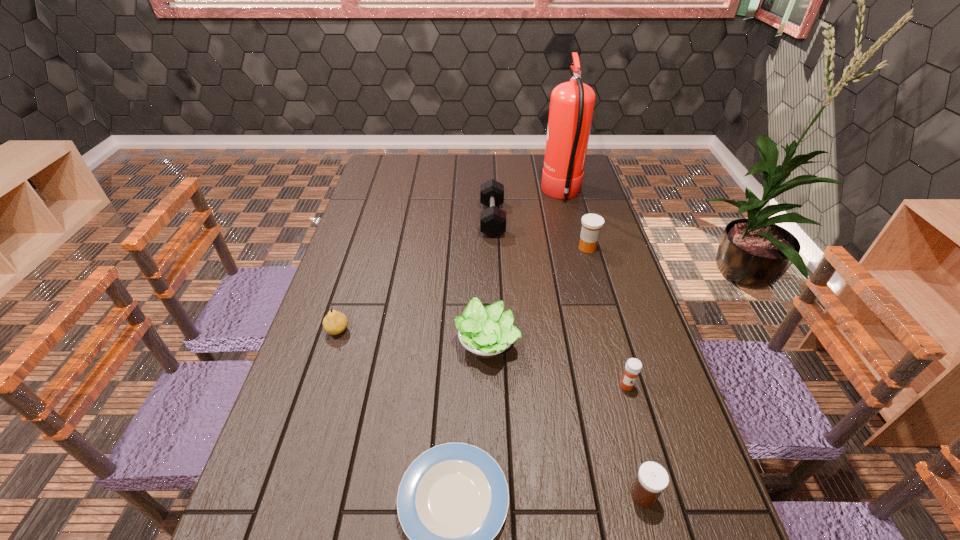
The height and width of the screenshot is (540, 960). I want to click on free space located towards the nozzle of the fire extinguisher, so click(x=529, y=195).

Locate an element on the screen. This screenshot has width=960, height=540. free spot located on the label of the third farthest object is located at coordinates (463, 248).

The height and width of the screenshot is (540, 960). I want to click on vacant region located on the label of the third farthest object, so click(x=535, y=248).

This screenshot has height=540, width=960. What are the coordinates of `vacant space situated 0.300m on the label of the third farthest object` in the screenshot? It's located at point(487,248).

Find the location of a particular element. The image size is (960, 540). vacant space located on the front of the dumbbell is located at coordinates (495, 306).

Locate an element on the screen. Image resolution: width=960 pixels, height=540 pixels. free location located 0.190m on the right of the leftmost object is located at coordinates (420, 330).

Find the location of a particular element. Image resolution: width=960 pixels, height=540 pixels. vacant space located on the back of the lettuce is located at coordinates (486, 243).

Find the location of `free space located 0.190m on the label side of the second nearest medicine`. free space located 0.190m on the label side of the second nearest medicine is located at coordinates (651, 471).

Find the location of a particular element. The width and height of the screenshot is (960, 540). vacant space located on the left of the nearest medicine is located at coordinates point(454,495).

This screenshot has height=540, width=960. In order to click on object present at the far edge in this screenshot , I will do `click(572, 103)`.